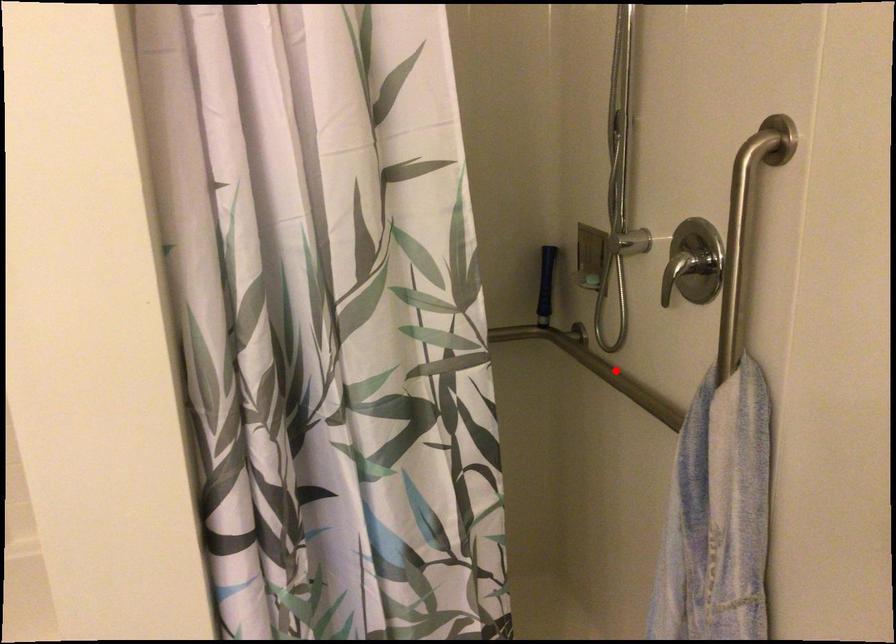
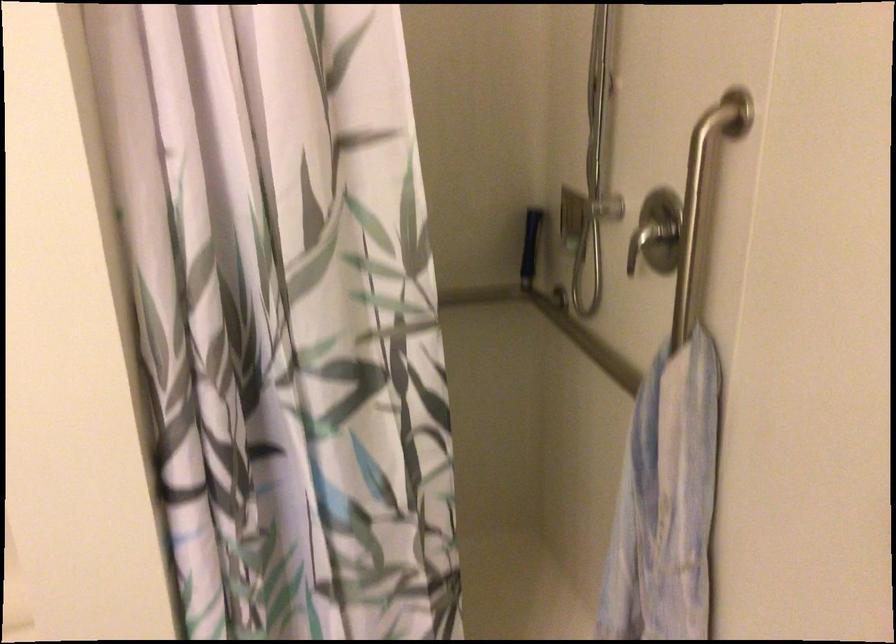
Locate, in the second image, the point that corresponds to the highlighted location in the first image.

(586, 341)